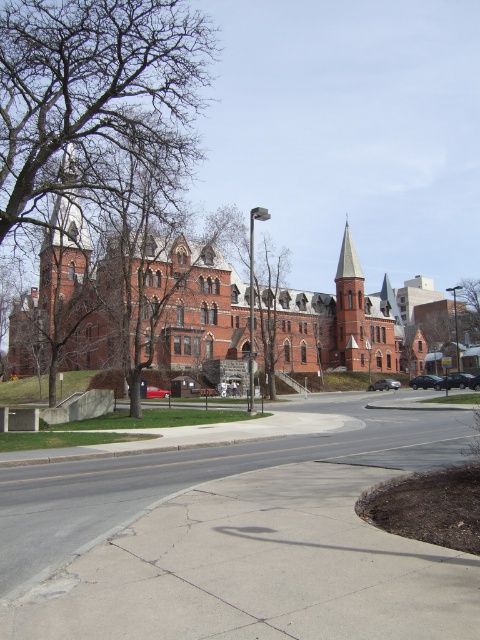
Can you confirm if concrete sidewalk at center is bigger than brown textured tree at center?

Incorrect, concrete sidewalk at center is not larger than brown textured tree at center.

Does concrete sidewalk at center appear on the right side of brown textured tree at center?

In fact, concrete sidewalk at center is to the left of brown textured tree at center.

Between point (12, 483) and point (274, 285), which one is positioned in front?

Positioned in front is point (12, 483).

The width and height of the screenshot is (480, 640). I want to click on concrete sidewalk at center, so click(240, 540).

Which is behind, point (384, 540) or point (181, 109)?

Point (181, 109)

Who is taller, concrete sidewalk at center or brown leafless tree at upper left?

brown leafless tree at upper left is taller.

Is point (308, 449) less distant than point (134, 145)?

Yes, it is.

What are the coordinates of `concrete sidewalk at center` in the screenshot? It's located at (240, 540).

Can you confirm if brown leafless tree at upper left is smaller than brown textured tree at center?

No, brown leafless tree at upper left is not smaller than brown textured tree at center.

From the picture: Who is higher up, brown leafless tree at upper left or brown textured tree at center?

Positioned higher is brown leafless tree at upper left.

Locate an element on the screen. The height and width of the screenshot is (640, 480). brown leafless tree at upper left is located at coordinates (92, 97).